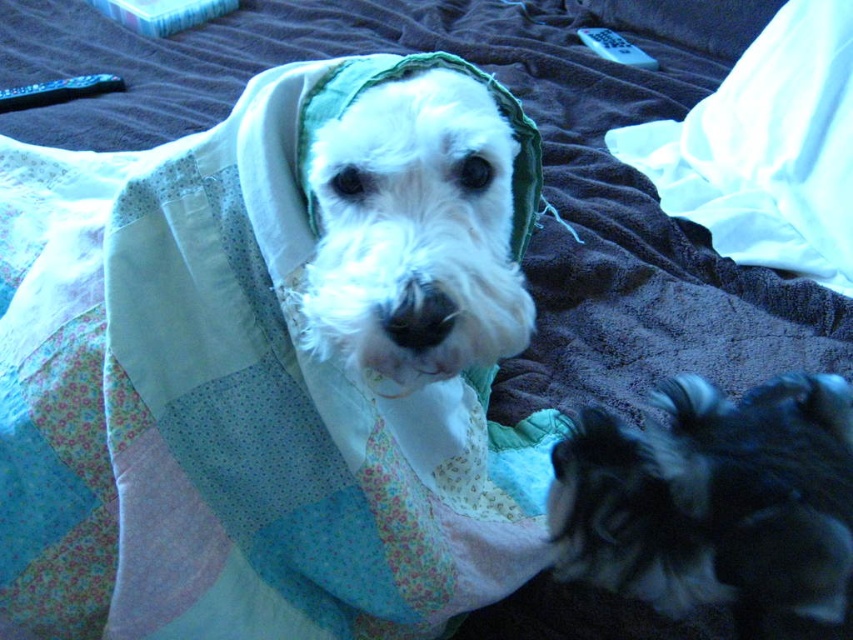
You are standing at the bed with the dark colored blanket and want to pick up an item from the area. There are two points marked in the image, point (740, 596) and point (740, 232). Which point is closer to you?

Point (740, 596) is in front of point (740, 232), so it is closer to you.

You are a pet sitter who needs to place a 12 inch long toy between the white fluffy dog at center and the white satin pillow at upper right. Is there enough space to fit the toy without moving either object?

The distance between the white fluffy dog at center and the white satin pillow at upper right is 32.25 inches. Since the toy is only 12 inches long, there is sufficient space to place it between them without moving either object.

You are a photographer setting up a shoot in the room described. You need to position a small light source so that it illuminates both the white fluffy dog at center and the white satin pillow at upper right without casting shadows on the dark blanket. Where should you place the light source relative to these objects?

The white fluffy dog at center is below the white satin pillow at upper right. To illuminate both without casting shadows on the dark blanket, place the light source above and between them, ensuring it shines downward over both objects.